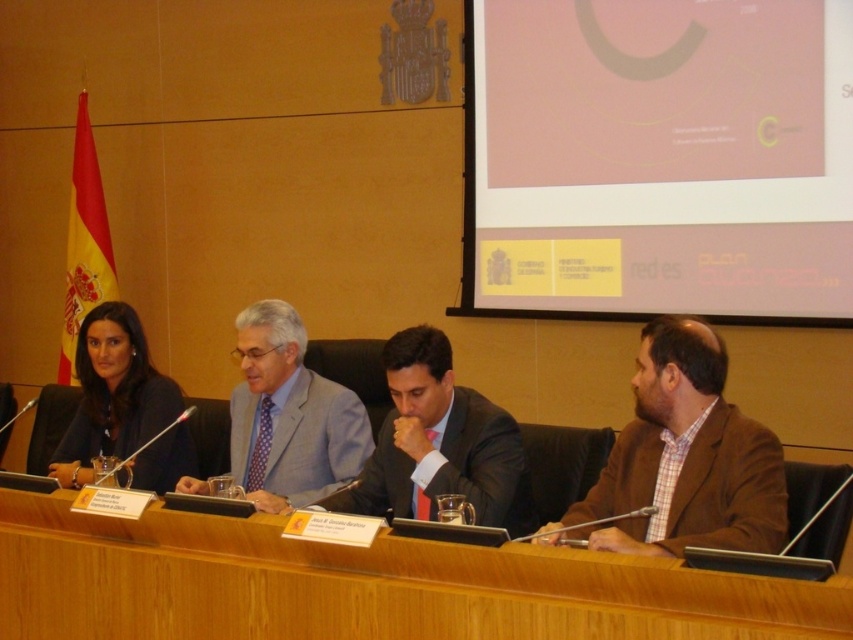
You are organizing a presentation and need to place a laptop on the table between the wooden at center and the matte black suit at center. Which side should you place it on to ensure it fits without exceeding the table space?

The wooden at center has a larger width than the matte black suit at center, so placing the laptop on the side of the wooden at center would provide more space and ensure it fits without exceeding the table space.

You are organizing a small presentation and need to place a nameplate for a guest speaker. The wooden at center and the matte black suit at center are both on the table. Which object should you place the nameplate next to to ensure it is visible and not obstructed?

The wooden at center is larger in size than the matte black suit at center, so placing the nameplate next to the wooden at center would provide more space and visibility, ensuring it is not obstructed.